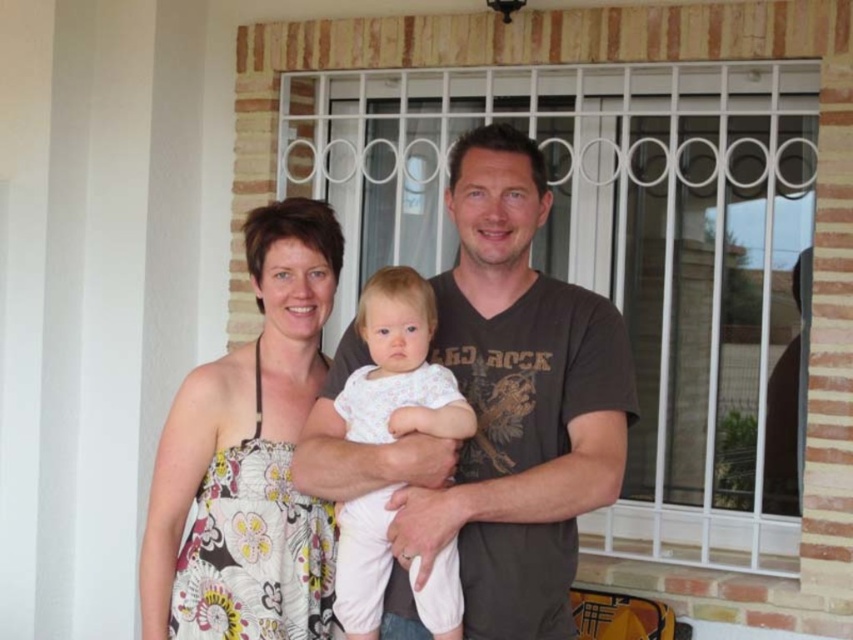
Does floral print dress at center have a smaller size compared to white cotton baby at center?

Incorrect, floral print dress at center is not smaller in size than white cotton baby at center.

Which of these two, floral print dress at center or white cotton baby at center, stands taller?

Standing taller between the two is floral print dress at center.

Does point (196, 390) come farther from viewer compared to point (352, 509)?

That is True.

Where is `floral print dress at center`? floral print dress at center is located at coordinates (248, 458).

Is the position of floral dress at center more distant than that of floral print dress at center?

No, it is in front of floral print dress at center.

Is point (548, 400) closer to viewer compared to point (277, 342)?

Yes.

Between point (589, 294) and point (265, 230), which one is positioned behind?

The point (265, 230) is behind.

In order to click on floral dress at center in this screenshot , I will do `click(495, 412)`.

Does white metal screen door at center appear on the right side of white cotton baby at center?

Indeed, white metal screen door at center is positioned on the right side of white cotton baby at center.

Can you confirm if white metal screen door at center is bigger than white cotton baby at center?

Yes, white metal screen door at center is bigger than white cotton baby at center.

Between point (769, 538) and point (361, 577), which one is positioned in front?

Point (361, 577)

I want to click on white metal screen door at center, so click(614, 252).